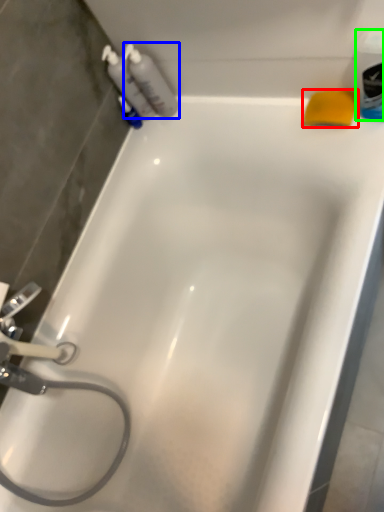
Question: Which object is the farthest from soap (highlighted by a red box)? Choose among these: cleaning product (highlighted by a blue box) or mouthwash (highlighted by a green box).

Choices:
 (A) cleaning product
 (B) mouthwash

Answer: (A)